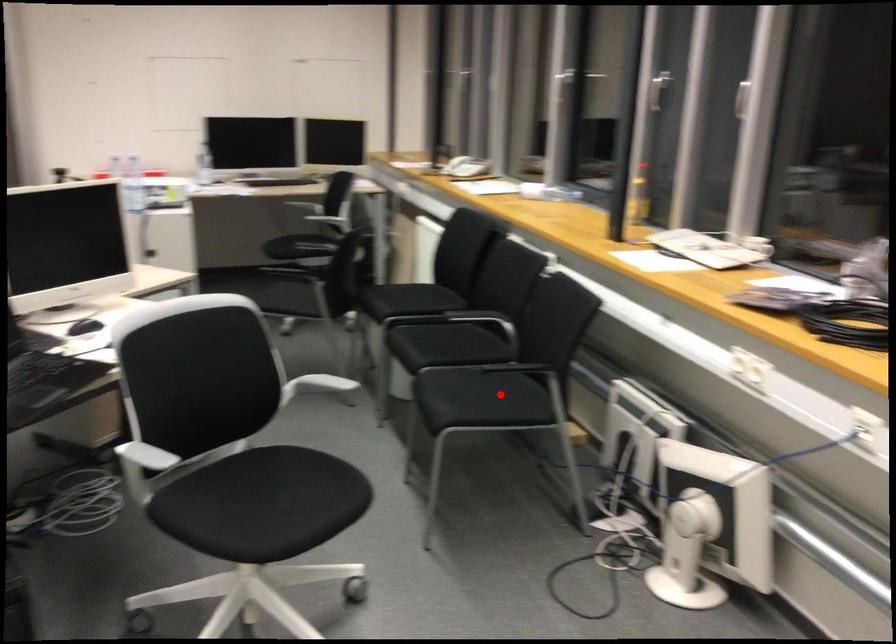
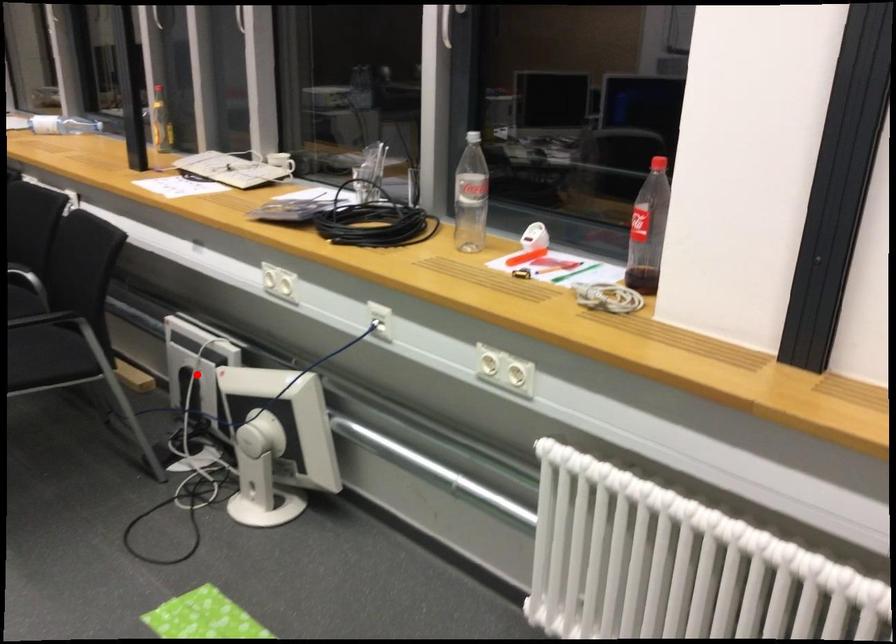
I am providing you with two images of the same scene from different viewpoints. A red point is marked on the first image and another point is marked on the second image. Is the red point in image1 aligned with the point shown in image2?

No